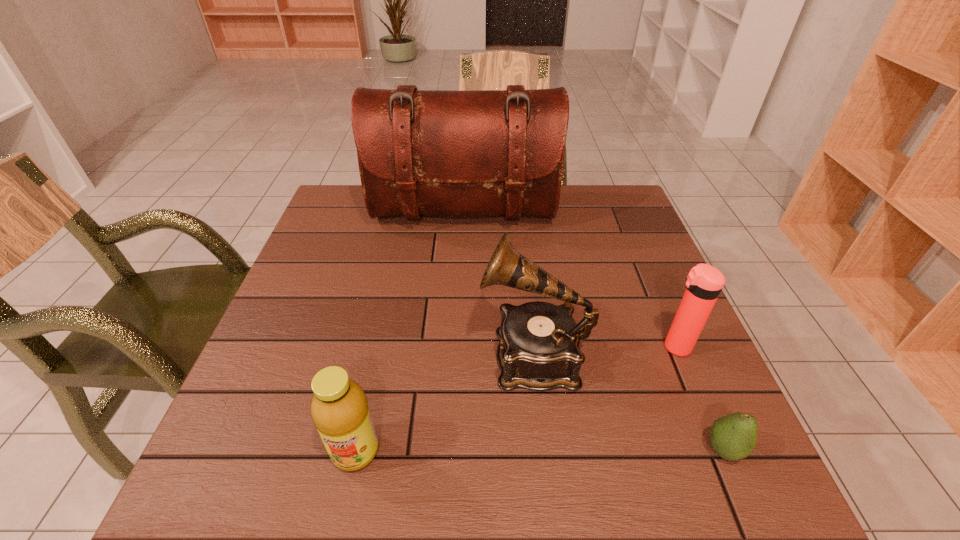
This screenshot has width=960, height=540. In order to click on object situated at the near right corner in this screenshot , I will do `click(733, 437)`.

Where is `blank space at the far edge`? This screenshot has width=960, height=540. blank space at the far edge is located at coordinates (502, 221).

The image size is (960, 540). What are the coordinates of `free space at the near edge of the desktop` in the screenshot? It's located at (391, 472).

In the image, there is a desktop. Identify the location of free space at the left edge. This screenshot has height=540, width=960. (321, 278).

Where is `vacant space at the right edge`? The image size is (960, 540). vacant space at the right edge is located at coordinates tap(609, 304).

Image resolution: width=960 pixels, height=540 pixels. What are the coordinates of `vacant space at the near left corner of the desktop` in the screenshot? It's located at (265, 482).

This screenshot has height=540, width=960. Find the location of `free spot at the far right corner of the desktop`. free spot at the far right corner of the desktop is located at coordinates (616, 219).

In the image, there is a desktop. Identify the location of vacant area at the near right corner. (705, 484).

The image size is (960, 540). What are the coordinates of `blank region between the second tallest object and the fruit juice` in the screenshot? It's located at (444, 403).

Identify the location of vacant space in between the tallest object and the thermos bottle. The image size is (960, 540). 569,280.